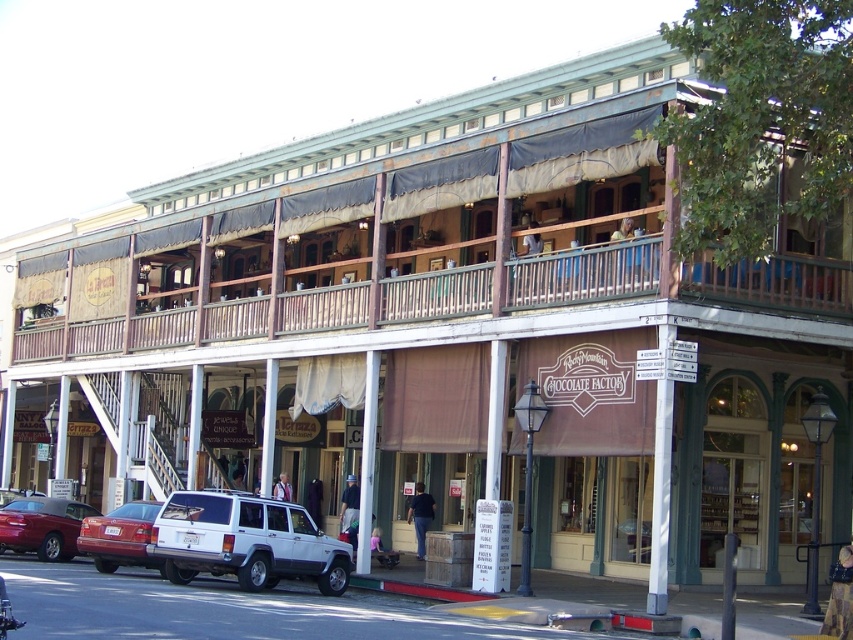
You are driving a car and want to park your vehicle in the parking lot behind the white matte suv at center. The parking lot has a maximum vehicle length requirement of 120 feet. Can you safely park your car there?

The white matte suv at center is 121.46 feet from camera, which exceeds the parking lot maximum length requirement of 120 feet. Therefore, your car may also be too long to park safely in this parking lot.

You are a customer arriving at the Chocolate Factory and need to park your car. You see a white matte suv at center and a matte red car at lower left. Which parking spot is closer to the entrance of the Chocolate Factory?

The white matte suv at center is positioned on the right side of matte red car at lower left, so the matte red car at lower left is closer to the entrance of the Chocolate Factory.

You are standing in front of the two story building. You see a point at coordinate [245,541]. What object is located at that point?

The point at coordinate [245,541] corresponds to the white matte suv at center.